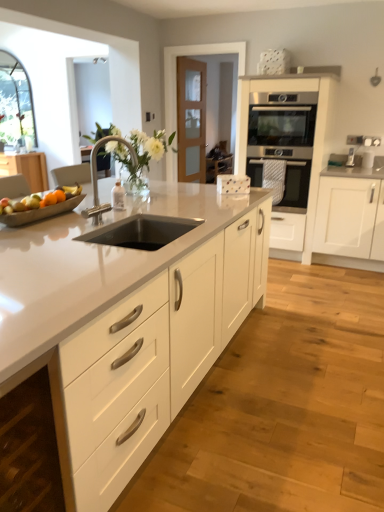
Identify the location of free spot in front of white matte vase at center. The width and height of the screenshot is (384, 512). (160, 206).